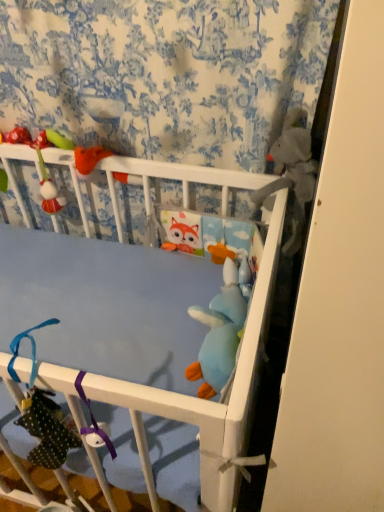
Question: Is soft blue plush toy at center, the second toy viewed from the left, at the right side of fuzzy fabric plush at upper left, the fourth toy positioned from the right?

Choices:
 (A) no
 (B) yes

Answer: (B)

Question: Considering the relative sizes of soft blue plush toy at center, the second toy viewed from the left, and fuzzy fabric plush at upper left, which ranks as the first toy in left-to-right order, in the image provided, is soft blue plush toy at center, the second toy viewed from the left, thinner than fuzzy fabric plush at upper left, which ranks as the first toy in left-to-right order,?

Choices:
 (A) no
 (B) yes

Answer: (A)

Question: Is soft blue plush toy at center, which appears as the 3th toy when viewed from the right, not within fuzzy fabric plush at upper left, which ranks as the first toy in left-to-right order?

Choices:
 (A) yes
 (B) no

Answer: (A)

Question: Is soft blue plush toy at center, the second toy viewed from the left, bigger than fuzzy fabric plush at upper left, which ranks as the first toy in left-to-right order?

Choices:
 (A) no
 (B) yes

Answer: (B)

Question: From a real-world perspective, is soft blue plush toy at center, which appears as the 3th toy when viewed from the right, on fuzzy fabric plush at upper left, the fourth toy positioned from the right?

Choices:
 (A) no
 (B) yes

Answer: (A)

Question: Is soft blue plush toy at center, the second toy viewed from the left, to the left of fuzzy fabric plush at upper left, the fourth toy positioned from the right, from the viewer's perspective?

Choices:
 (A) yes
 (B) no

Answer: (B)

Question: Considering the relative sizes of soft blue plush toy at center, which appears as the 3th toy when viewed from the right, and blue plush toy at center, which is the 3th toy in left-to-right order, in the image provided, is soft blue plush toy at center, which appears as the 3th toy when viewed from the right, wider than blue plush toy at center, which is the 3th toy in left-to-right order,?

Choices:
 (A) yes
 (B) no

Answer: (A)

Question: Does soft blue plush toy at center, the second toy viewed from the left, have a smaller size compared to blue plush toy at center, acting as the 2th toy starting from the right?

Choices:
 (A) no
 (B) yes

Answer: (A)

Question: From a real-world perspective, is soft blue plush toy at center, which appears as the 3th toy when viewed from the right, on top of blue plush toy at center, which is the 3th toy in left-to-right order?

Choices:
 (A) yes
 (B) no

Answer: (A)

Question: Does soft blue plush toy at center, the second toy viewed from the left, have a lesser width compared to blue plush toy at center, acting as the 2th toy starting from the right?

Choices:
 (A) no
 (B) yes

Answer: (A)

Question: Is soft blue plush toy at center, the second toy viewed from the left, facing away from blue plush toy at center, acting as the 2th toy starting from the right?

Choices:
 (A) yes
 (B) no

Answer: (B)

Question: Is there a large distance between soft blue plush toy at center, the second toy viewed from the left, and blue plush toy at center, which is the 3th toy in left-to-right order?

Choices:
 (A) no
 (B) yes

Answer: (A)

Question: Is fuzzy fabric plush at upper left, which ranks as the first toy in left-to-right order, turned away from gray plush toy at upper right, which ranks as the 4th toy in left-to-right order?

Choices:
 (A) yes
 (B) no

Answer: (B)